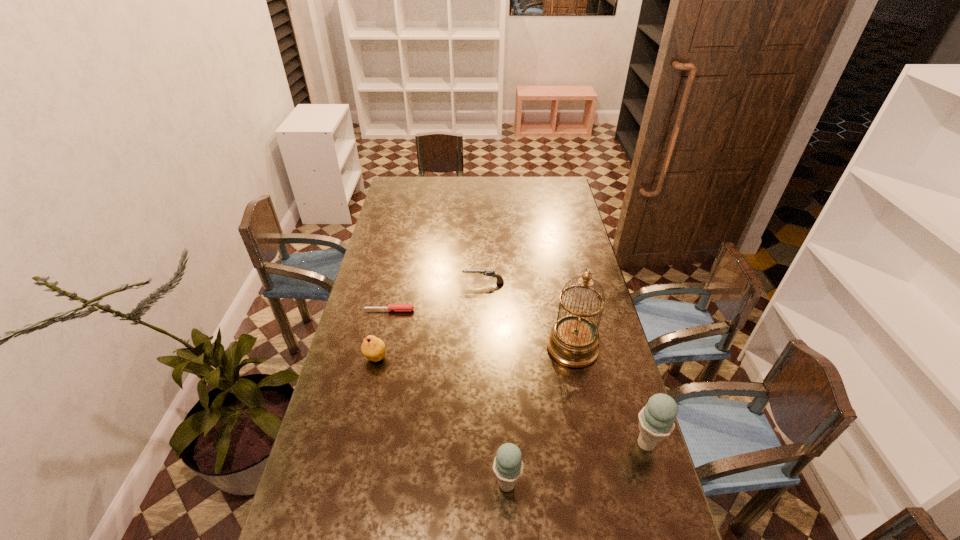
Where is `vacant area at the far right corner of the desktop`? Image resolution: width=960 pixels, height=540 pixels. vacant area at the far right corner of the desktop is located at coordinates (552, 187).

In order to click on vacant area that lies between the farther ice cream and the birdcage in this screenshot , I will do `click(610, 396)`.

At what (x,y) coordinates should I click in order to perform the action: click on free space between the third shortest object and the second object from right to left. Please return your answer as a coordinate pair (x, y). The width and height of the screenshot is (960, 540). Looking at the image, I should click on (474, 353).

In order to click on free spot between the right ice cream and the second object from right to left in this screenshot , I will do `click(610, 396)`.

The height and width of the screenshot is (540, 960). I want to click on vacant space in between the farther ice cream and the shortest object, so [517, 377].

I want to click on vacant area that lies between the fifth object from left to right and the screwdriver, so click(481, 329).

Find the location of `blank region between the second object from right to left and the gun`. blank region between the second object from right to left and the gun is located at coordinates (528, 316).

The image size is (960, 540). What are the coordinates of `free space between the pear and the birdcage` in the screenshot? It's located at (474, 353).

At what (x,y) coordinates should I click in order to perform the action: click on free space between the birdcage and the fourth tallest object. Please return your answer as a coordinate pair (x, y). Looking at the image, I should click on (474, 353).

Identify the location of empty space that is in between the nearer ice cream and the fifth object from left to right. Image resolution: width=960 pixels, height=540 pixels. (540, 416).